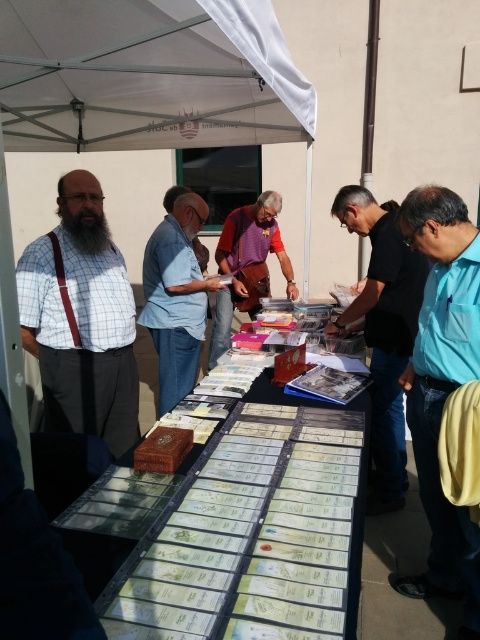
You are at an outdoor event and see two people wearing a black matte shirt at center and a blue cotton shirt at center. Which person is standing on the left side?

The blue cotton shirt at center is on the left side because the black matte shirt at center is to the right of it.

You are standing at the entrance of the tent and want to approach the black matte shirt at center. Which direction should you walk to reach them?

The black matte shirt at center is located at point 0.519 on the x axis and 0.798 on the y axis. Since you are at the entrance, you should walk towards the center of the tent to reach them.

You are organizing a clothing size chart for an online store. You have two shirts displayed in the scene, the black matte shirt at center and the blue cotton shirt at center. Which shirt would you list as the smaller size?

The black matte shirt at center is smaller than the blue cotton shirt at center, so it should be listed as the smaller size.